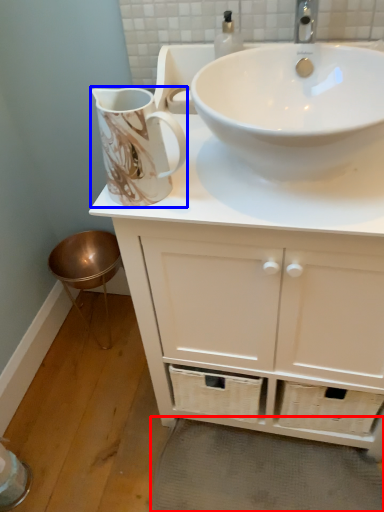
Question: Which of the following is the farthest to the observer, bath mat (highlighted by a red box) or jug (highlighted by a blue box)?

Choices:
 (A) bath mat
 (B) jug

Answer: (A)